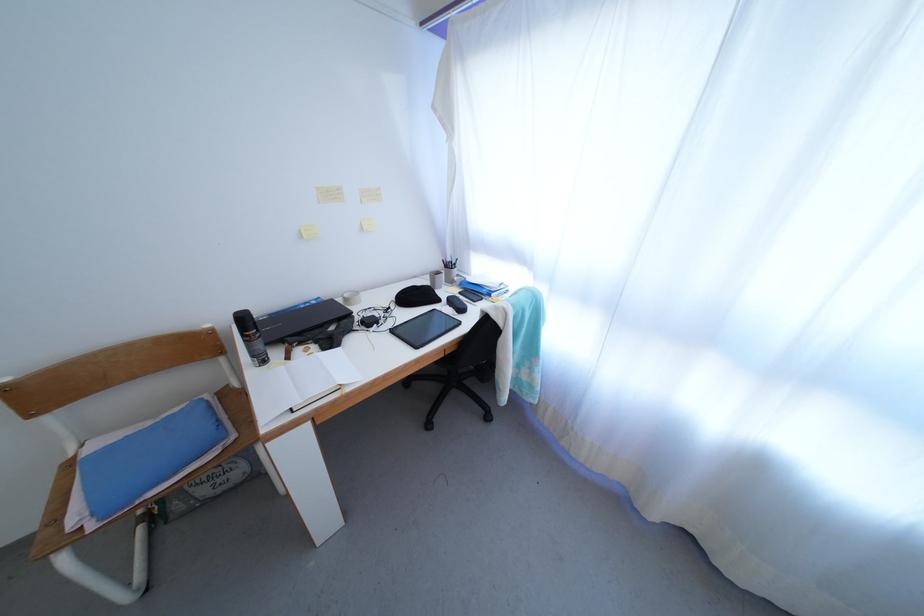
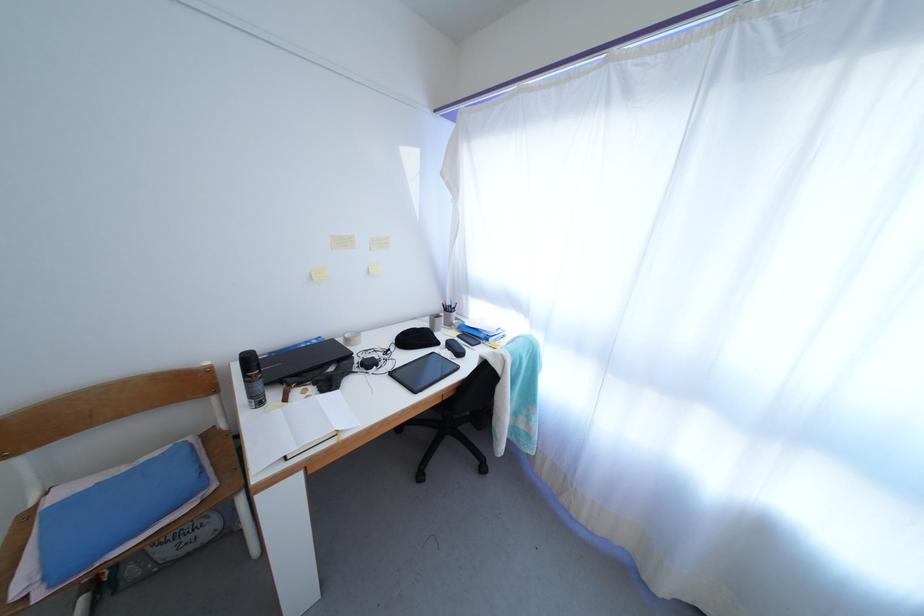
The point at (294, 363) is marked in the first image. Where is the corresponding point in the second image?

(290, 406)